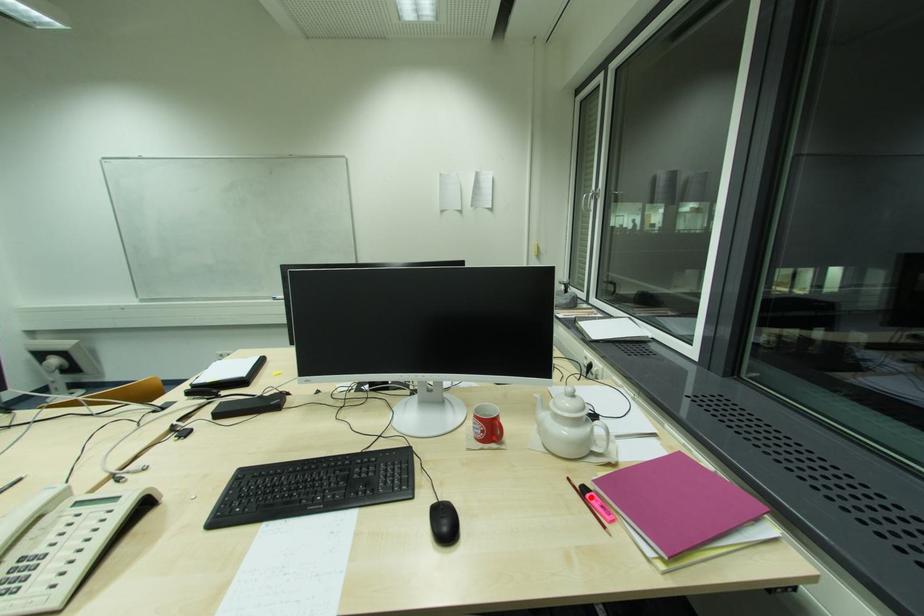
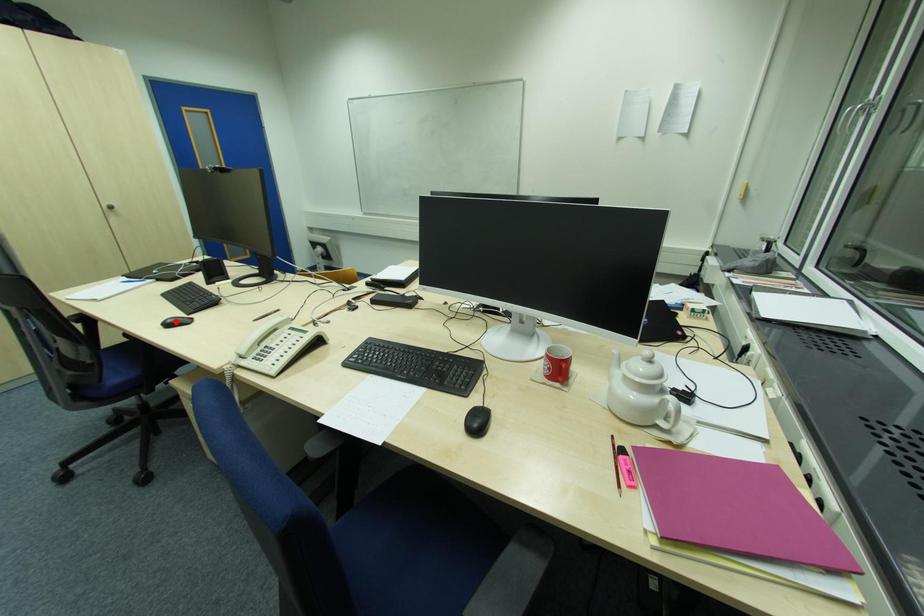
I am providing you with two images of the same scene from different viewpoints. A red point is marked on the first image and another point is marked on the second image. Are the points marked in image1 and image2 representing the same 3D position?

No